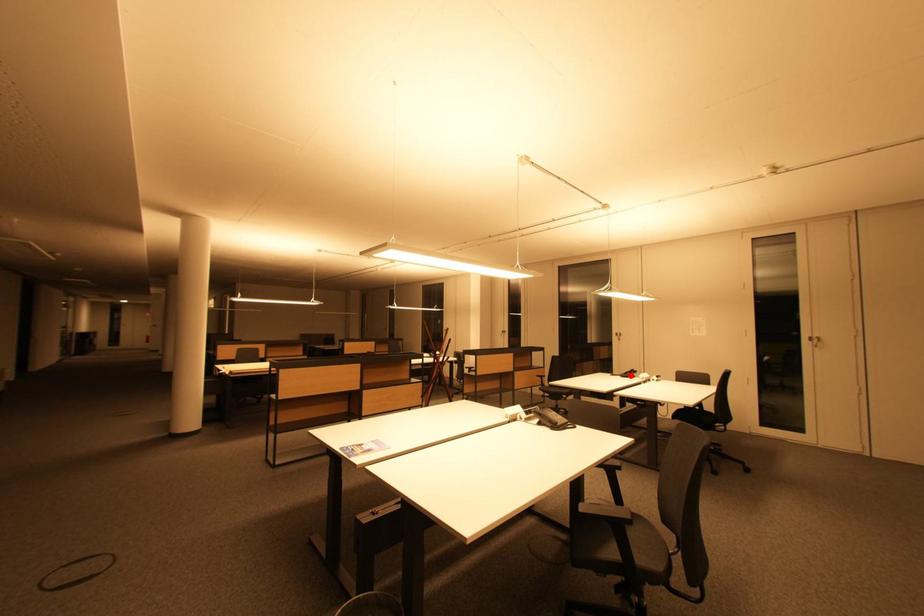
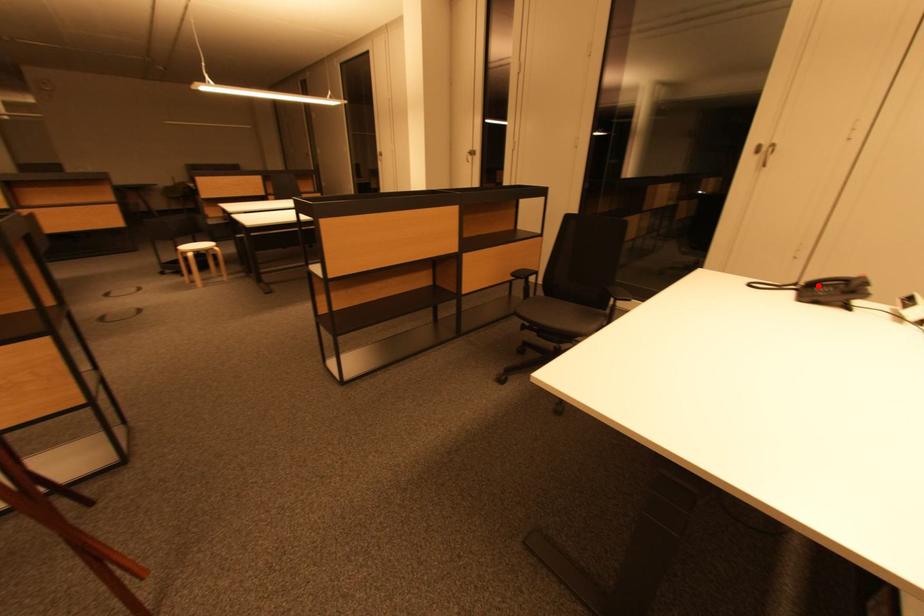
I am providing you with two images of the same scene from different viewpoints. A red point is marked on the first image and another point is marked on the second image. Is the red point in image1 aligned with the point shown in image2?

Yes